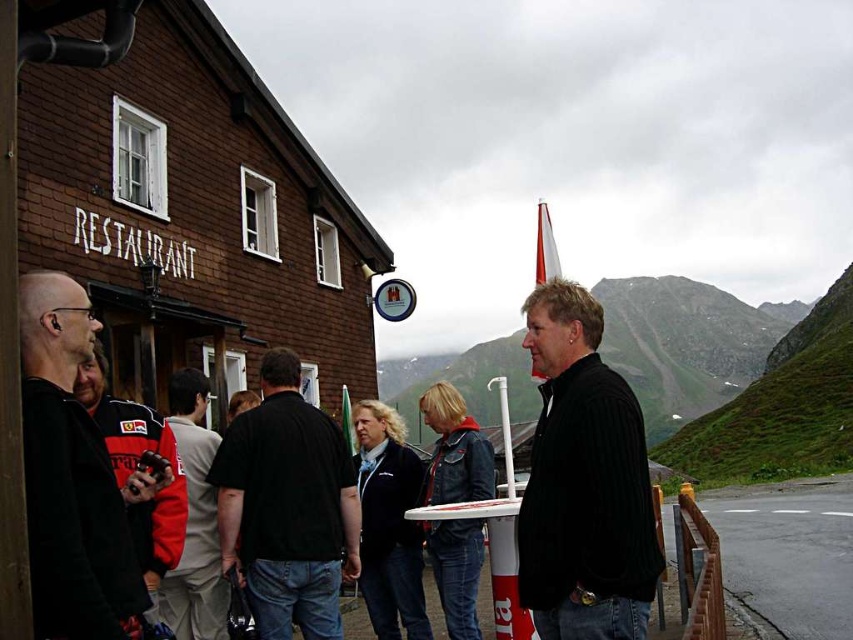
In the scene shown: You are a photographer trying to capture a group photo of the people at the rustic restaurant. You notice two jackets in the center of the group. Which jacket should you focus on if you want to include both the black corduroy jacket at center and the red and white jacket at center in the frame without moving the camera?

You should focus on the red and white jacket at center because the black corduroy jacket at center is positioned to its right, so keeping the red and white jacket centered will ensure both jackets are in the frame.

You are a photographer trying to capture a group photo of the black cotton shirt at center and the red and white jacket at center. Since you want to ensure both subjects are in focus, which subject should you position closer to the camera to account for their size difference?

The black cotton shirt at center has a larger width than the red and white jacket at center. To ensure both are in focus, position the red and white jacket at center closer to the camera so that their apparent sizes become more balanced.